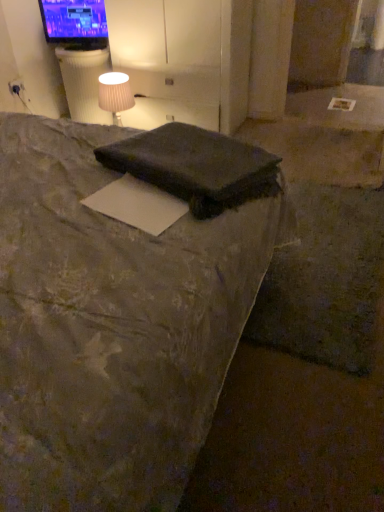
Question: In the image, is dark gray fabric pillow at center on the left side or the right side of matte white outlet at upper left?

Choices:
 (A) right
 (B) left

Answer: (A)

Question: Considering the positions of dark gray fabric pillow at center and matte white outlet at upper left in the image, is dark gray fabric pillow at center taller or shorter than matte white outlet at upper left?

Choices:
 (A) short
 (B) tall

Answer: (A)

Question: Based on their relative distances, which object is nearer to the white matte paper at center?

Choices:
 (A) dark gray fabric pillow at center
 (B) white ribbed table at upper left
 (C) matte black tv at upper left
 (D) matte white outlet at upper left
 (E) matte white fabric at upper left

Answer: (A)

Question: Which object is the farthest from the white matte paper at center?

Choices:
 (A) dark gray fabric pillow at center
 (B) matte black tv at upper left
 (C) white ribbed table at upper left
 (D) dark gray fabric bed at center
 (E) matte white fabric at upper left

Answer: (B)